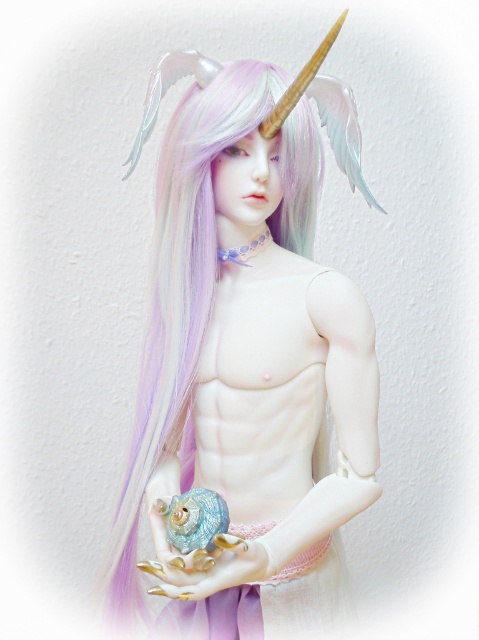
Who is more forward, (236, 506) or (218, 544)?

Point (218, 544) is more forward.

The height and width of the screenshot is (640, 479). I want to click on pastel matte unicorn horn at upper center, so click(249, 356).

Image resolution: width=479 pixels, height=640 pixels. What are the coordinates of `pastel matte unicorn horn at upper center` in the screenshot? It's located at (249, 356).